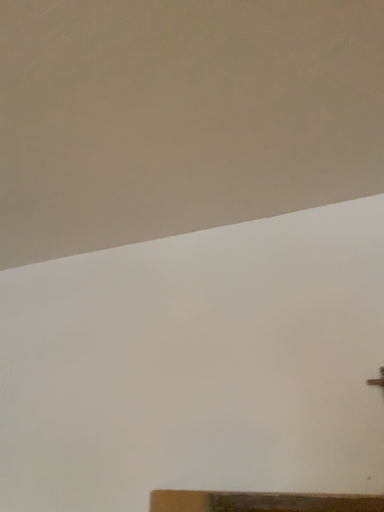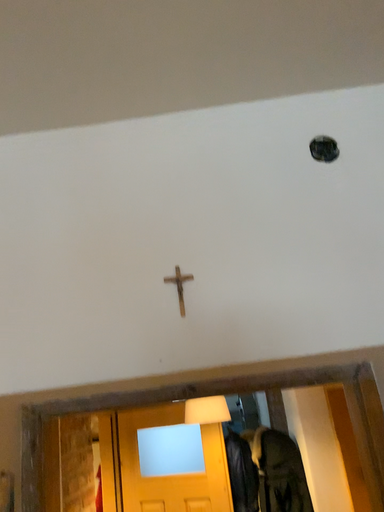
Question: Which way did the camera rotate in the video?

Choices:
 (A) rotated upward
 (B) rotated downward

Answer: (B)